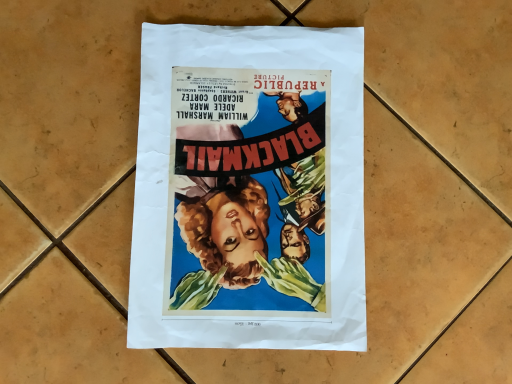
Where is `matte paper poster at center`? The height and width of the screenshot is (384, 512). matte paper poster at center is located at coordinates (249, 189).

The image size is (512, 384). What do you see at coordinates (249, 189) in the screenshot? I see `matte paper poster at center` at bounding box center [249, 189].

You are a GUI agent. You are given a task and a screenshot of the screen. Output one action in this format:
    pyautogui.click(x=<x>, y=<y>)
    Task: Click on the matte paper poster at center
    This screenshot has width=512, height=384.
    Given the screenshot: What is the action you would take?
    (x=249, y=189)